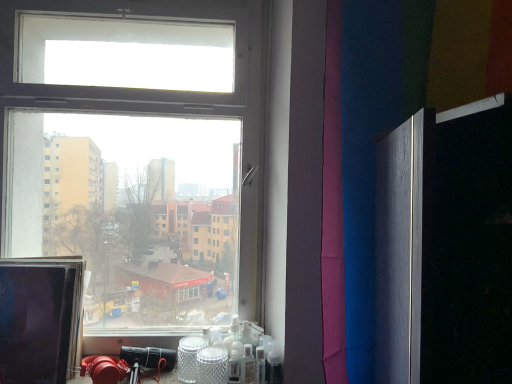
Question: Is matte black monitor at left wider or thinner than transparent glass window at center?

Choices:
 (A) wide
 (B) thin

Answer: (B)

Question: Considering the relative positions of matte black monitor at left and transparent glass window at center in the image provided, is matte black monitor at left to the left or to the right of transparent glass window at center?

Choices:
 (A) left
 (B) right

Answer: (A)

Question: Estimate the real-world distances between objects in this image. Which object is closer to the purple fabric at right?

Choices:
 (A) translucent plastic spray bottle at lower right, which ranks as the 2th toiletry in left-to-right order
 (B) transparent glass window at center
 (C) clear plastic spray bottle at lower center, the 1th toiletry when ordered from left to right
 (D) matte black monitor at left

Answer: (A)

Question: Estimate the real-world distances between objects in this image. Which object is closer to the clear plastic spray bottle at lower center, acting as the 2th toiletry starting from the right?

Choices:
 (A) translucent plastic spray bottle at lower right, which appears as the first toiletry when viewed from the right
 (B) purple fabric at right
 (C) matte black monitor at left
 (D) transparent glass window at center

Answer: (A)